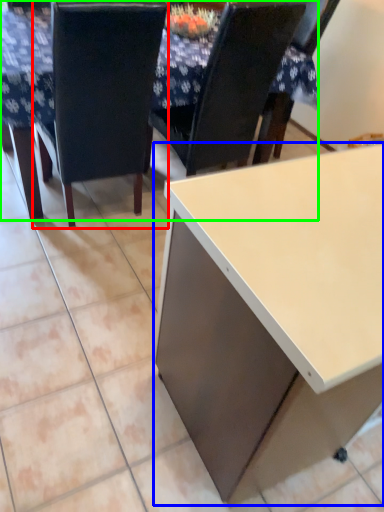
Question: Estimate the real-world distances between objects in this image. Which object is closer to chair (highlighted by a red box), desk (highlighted by a blue box) or table (highlighted by a green box)?

Choices:
 (A) desk
 (B) table

Answer: (B)